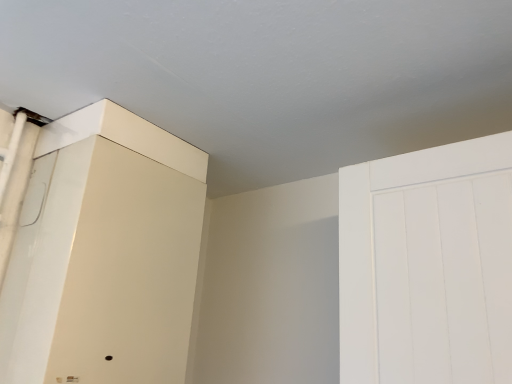
What is the approximate height of matte white cabinet at left?

26.80 inches.

The height and width of the screenshot is (384, 512). Describe the element at coordinates (104, 272) in the screenshot. I see `matte white cabinet at left` at that location.

Where is `matte white cabinet at left`? This screenshot has height=384, width=512. matte white cabinet at left is located at coordinates (104, 272).

Image resolution: width=512 pixels, height=384 pixels. I want to click on matte white cabinet at left, so click(x=104, y=272).